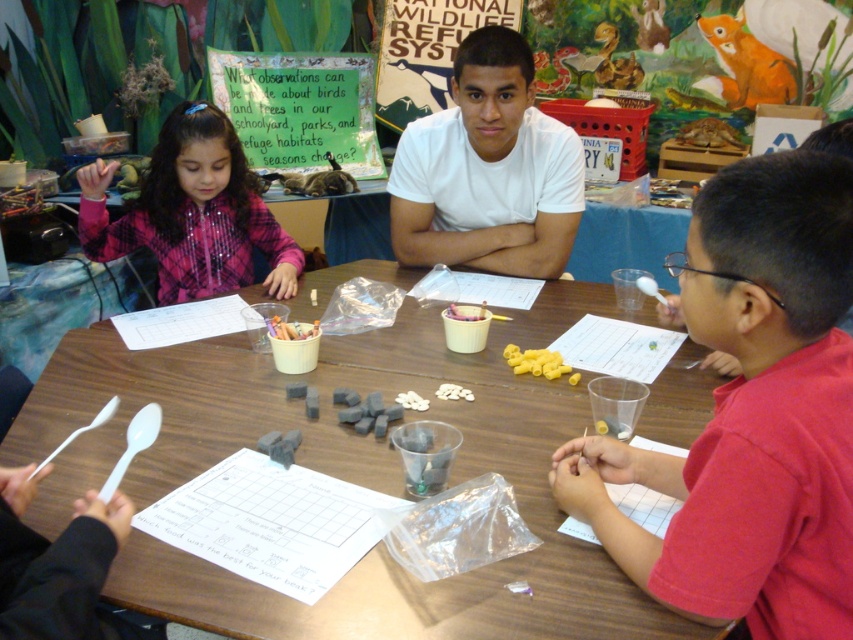
You are a teacher in a classroom. You need to place a new poster on the wall above the white plastic cup at center. Where should you place it so that it is at the same height as the green paper sign at upper center?

Place the new poster at the same height as the green paper sign at upper center, which is already positioned above the white plastic cup at center.

In the scene shown: You are a teacher in the classroom scene. You need to hand out a new worksheet to the children. The worksheet is on your desk, which is to the left of the white plastic cup at center. Can you reach the worksheet without moving the yellow matte pasta at center?

The white plastic cup at center is behind the yellow matte pasta at center, so you can reach the worksheet on your desk without moving the yellow matte pasta at center because the desk is to the left of the cup, and the pasta is in front of the cup but not blocking the desk direction.

You are a teacher standing at the back of the classroom. You notice two points on the table where students are working. The first point is at coordinates point (573, 376) and the second is at point (277, 326). If you want to place a new worksheet closer to the students working at the first point without moving it past the second point, where should you place it?

The worksheet should be placed between point (573, 376) and point (277, 326), ensuring it stays closer to the first point but does not cross beyond the second point. Since point (573, 376) is in front of point (277, 326), positioning it slightly behind the first point but ahead of the second point would achieve this.